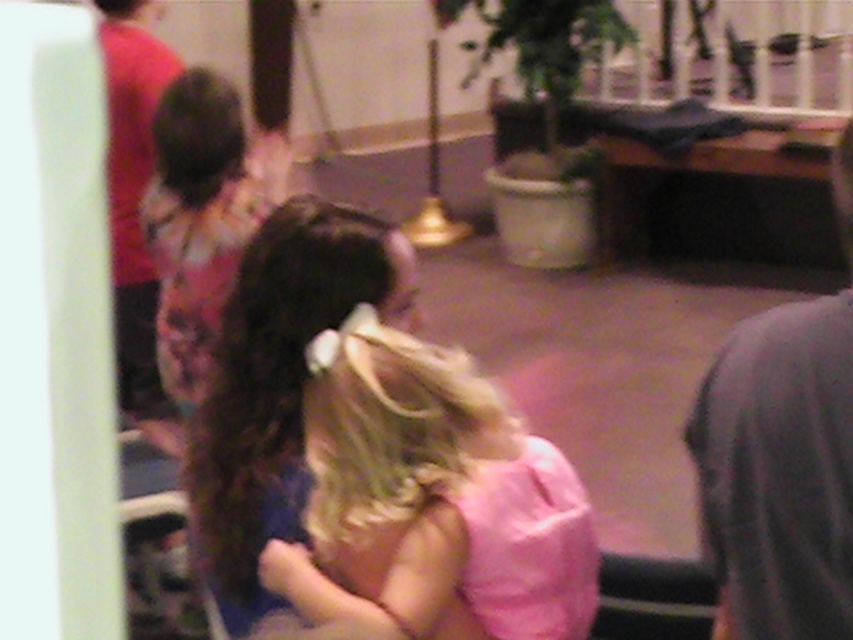
You are a photographer trying to capture a clear shot of the dark brown silky hair at center. Given that your camera has a minimum focus distance of 1.5 meters, will you be able to focus on it properly?

The dark brown silky hair at center is 1.53 meters from the viewer, which is just beyond the camera minimum focus distance of 1.5 meters. Therefore, the camera can focus on it properly.

You are a photographer trying to capture a clearer shot of the dark brown silky hair at center and the red shirt at left. Based on the scene description, which object is positioned lower in the image?

The dark brown silky hair at center is located below the red shirt at left, so it is positioned lower in the image.